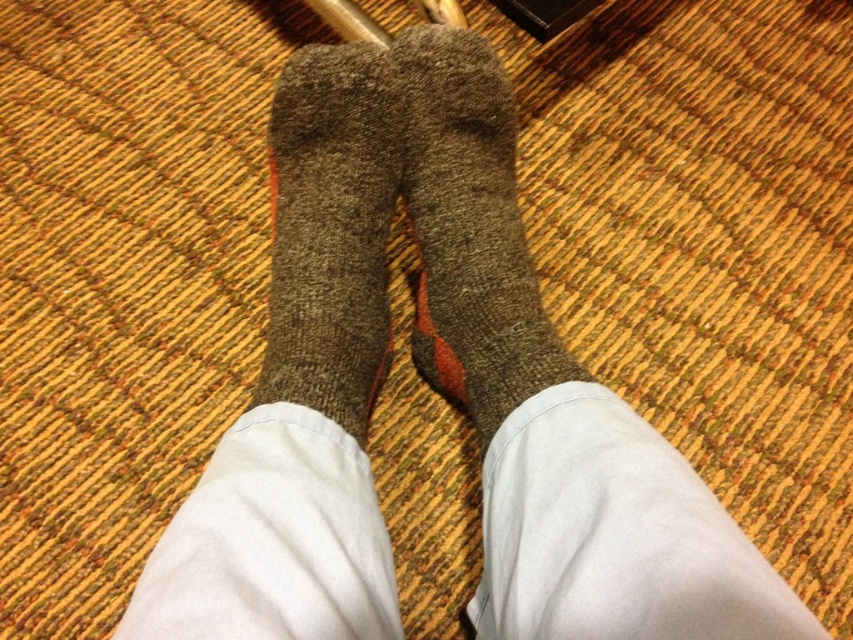
How distant is gray woolen sock at center from brown woolen sock at center?

gray woolen sock at center is 3.39 inches from brown woolen sock at center.

Is point (461, 40) closer to camera compared to point (288, 148)?

Yes, it is.

What do you see at coordinates (469, 230) in the screenshot? I see `gray woolen sock at center` at bounding box center [469, 230].

Find the location of a particular element. This screenshot has height=640, width=853. gray woolen sock at center is located at coordinates (469, 230).